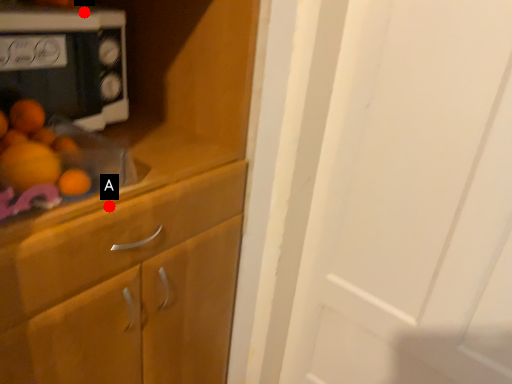
Question: Two points are circled on the image, labeled by A and B beside each circle. Which point appears closest to the camera in this image?

Choices:
 (A) A is closer
 (B) B is closer

Answer: (A)